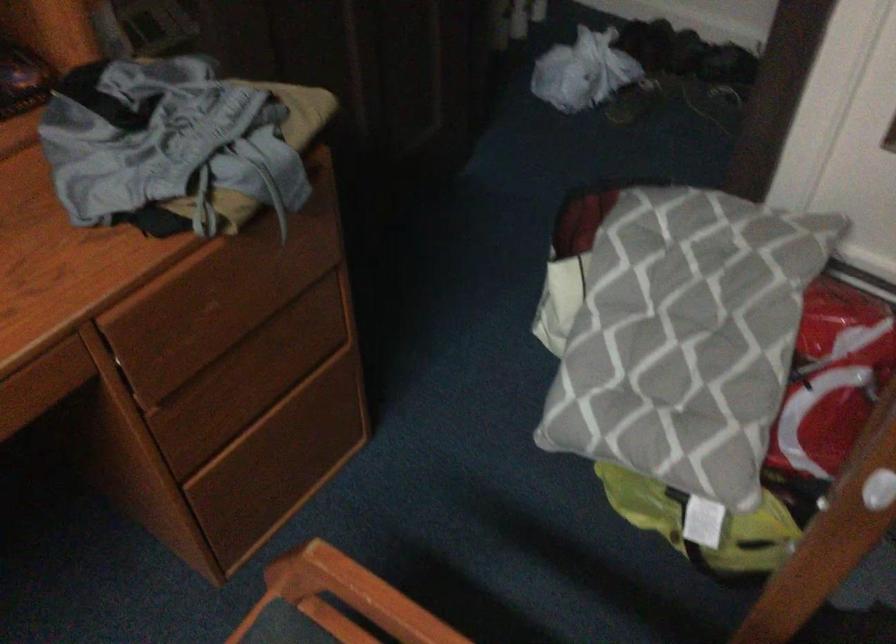
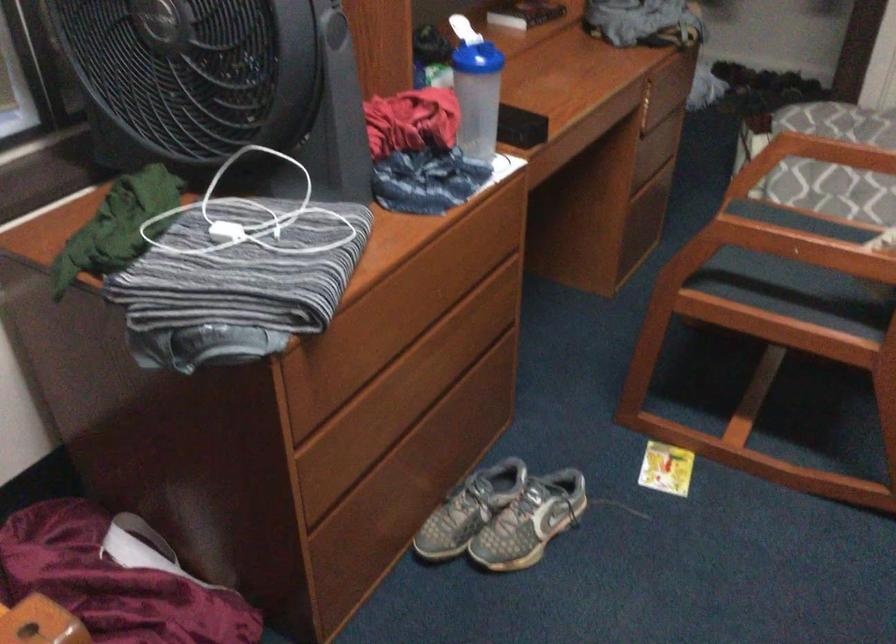
Find the pixel in the second image that matches (x=211, y=442) in the first image.

(643, 169)